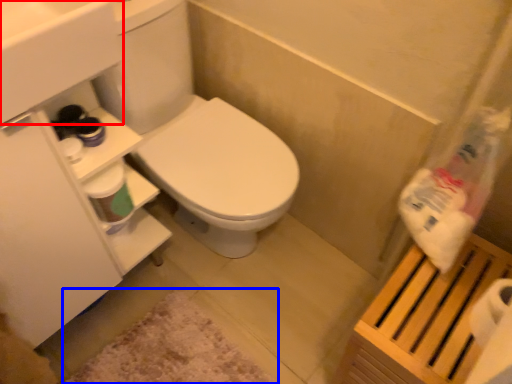
Question: Which point is further to the camera, sink (highlighted by a red box) or bath mat (highlighted by a blue box)?

Choices:
 (A) sink
 (B) bath mat

Answer: (B)